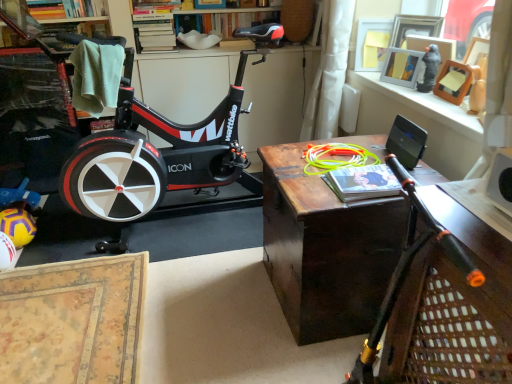
Question: Does point (162, 0) appear closer or farther from the camera than point (89, 4)?

Choices:
 (A) farther
 (B) closer

Answer: (A)

Question: In terms of width, does wooden bookshelf at upper center look wider or thinner when compared to hardcover book at upper left, acting as the second book starting from the front?

Choices:
 (A) wide
 (B) thin

Answer: (A)

Question: Which object is the farthest from the dark wood table at center?

Choices:
 (A) wooden bookshelf at upper center
 (B) hardcover book at center, positioned as the second book in left-to-right order
 (C) black matte stationary bicycle at center
 (D) hardcover book at upper left, which is the 1th book in top-to-bottom order
 (E) black plastic speaker at upper right

Answer: (D)

Question: Considering the real-world distances, which object is closest to the black plastic speaker at upper right?

Choices:
 (A) black matte stationary bicycle at center
 (B) hardcover book at center, the first book ordered from the bottom
 (C) wooden frame at upper right
 (D) wooden bookshelf at upper center
 (E) hardcover book at upper left, acting as the 2th book starting from the bottom

Answer: (C)